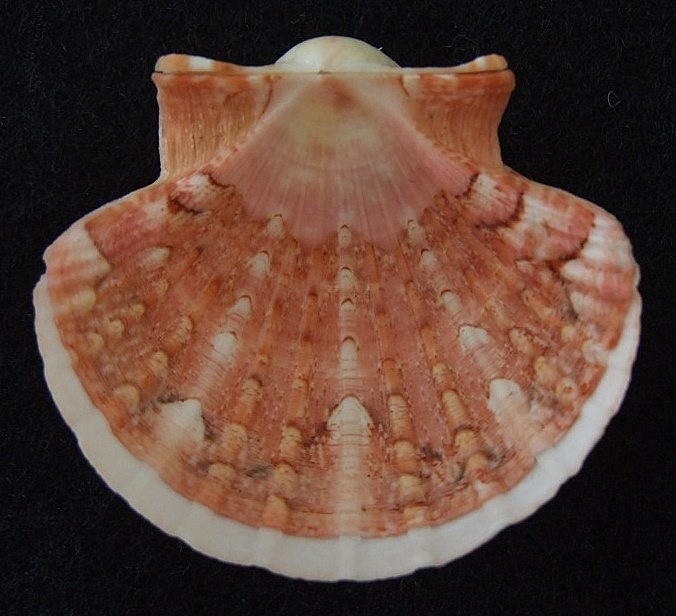
You are a GUI agent. You are given a task and a screenshot of the screen. Output one action in this format:
    pyautogui.click(x=<x>, y=<y>)
    Task: Click on the pink columns
    The height and width of the screenshot is (616, 676).
    Given the screenshot: What is the action you would take?
    pyautogui.click(x=260, y=362), pyautogui.click(x=299, y=366), pyautogui.click(x=182, y=331), pyautogui.click(x=142, y=301), pyautogui.click(x=389, y=357), pyautogui.click(x=426, y=357), pyautogui.click(x=512, y=323), pyautogui.click(x=531, y=294)